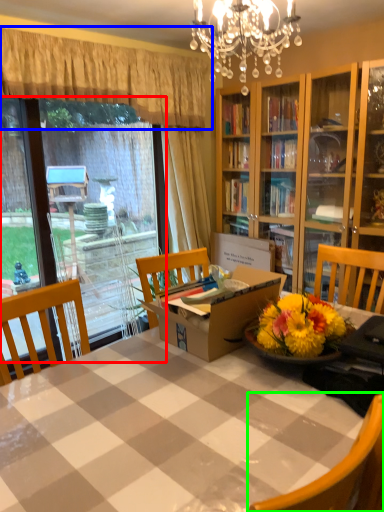
Question: Which object is the farthest from glass door (highlighted by a red box)? Choose among these: curtain (highlighted by a blue box) or chair (highlighted by a green box).

Choices:
 (A) curtain
 (B) chair

Answer: (B)